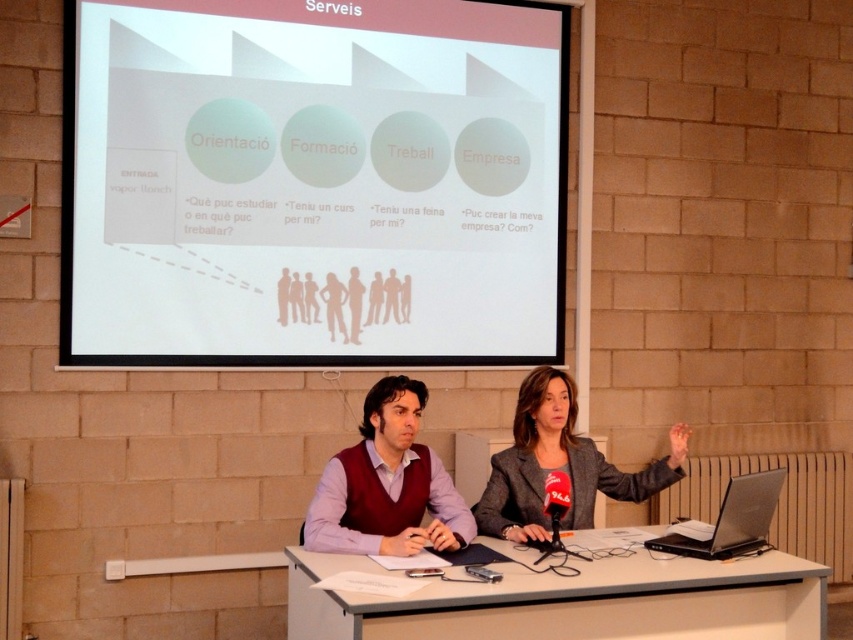
You are a presenter standing at the front of the room. You need to hand out a brochure to the silhouette paper people at center. The brochure is currently placed on the gray fabric blazer at center. Can you reach it without moving from your current position?

The gray fabric blazer at center is 5.70 feet away from the silhouette paper people at center. Since the presenter is at the front of the room and the blazer is at center, it is likely within reach if the presenter can extend their arm or take a step forward. However, the exact distance may require the presenter to move slightly closer.

You are an attendee at this presentation and you want to know which object is taller between the gray fabric blazer at center and the silhouette paper people at center. Can you tell me?

The gray fabric blazer at center is taller than the silhouette paper people at center according to the description.